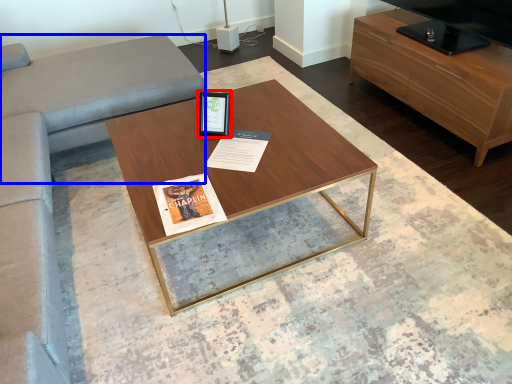
Question: Which of the following is the farthest to the observer, picture frame (highlighted by a red box) or gray (highlighted by a blue box)?

Choices:
 (A) picture frame
 (B) gray

Answer: (A)